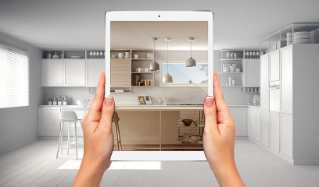
Where is `lights`? lights is located at coordinates (192, 59).